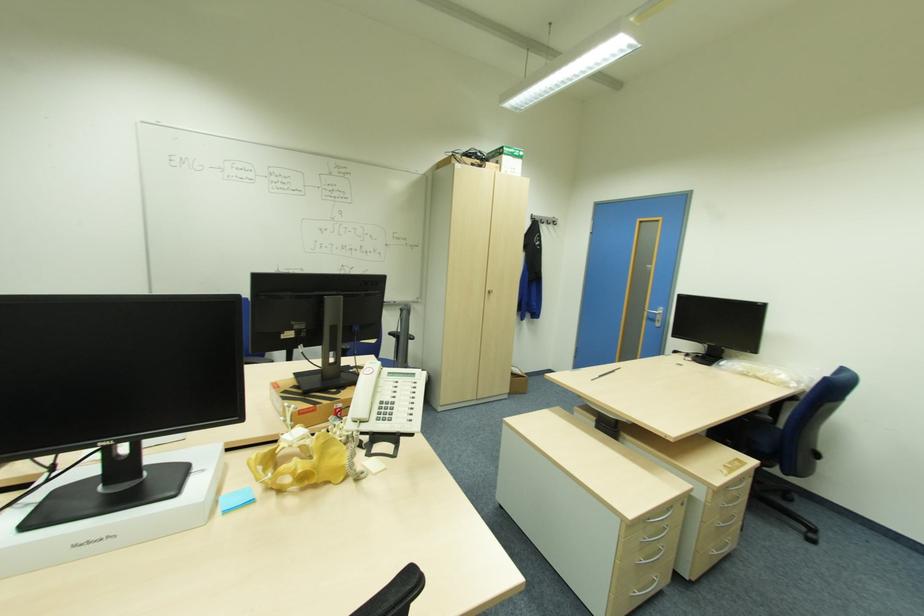
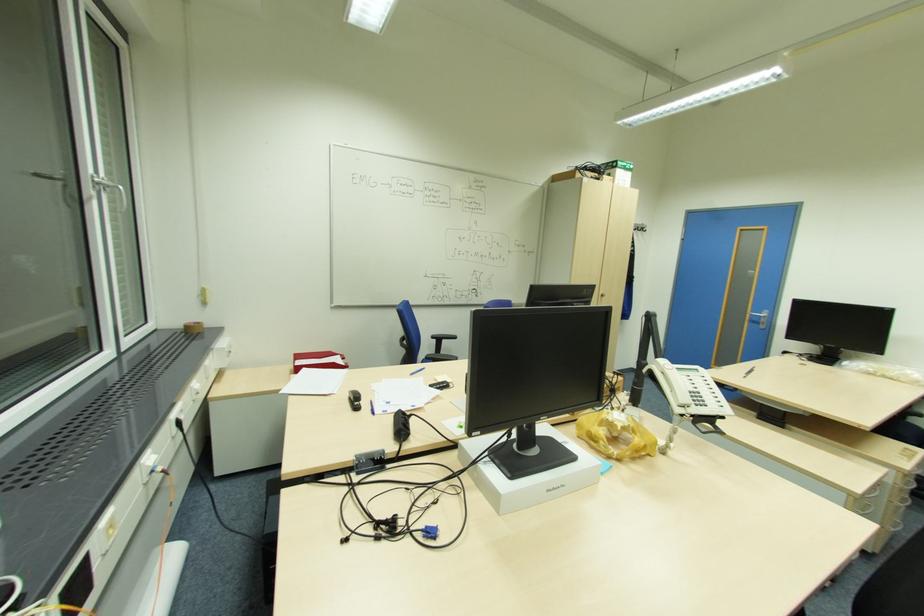
In the second image, find the point that corresponds to the point at 629,525 in the first image.

(857, 498)